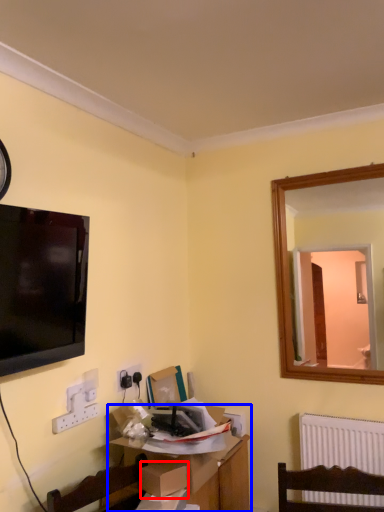
Question: Which of the following is the farthest to the observer, cardboard box (highlighted by a red box) or table (highlighted by a blue box)?

Choices:
 (A) cardboard box
 (B) table

Answer: (B)